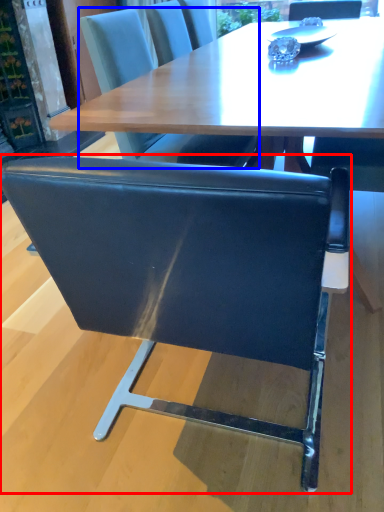
Question: Which object is closer to the camera taking this photo, chair (highlighted by a red box) or chair (highlighted by a blue box)?

Choices:
 (A) chair
 (B) chair

Answer: (A)